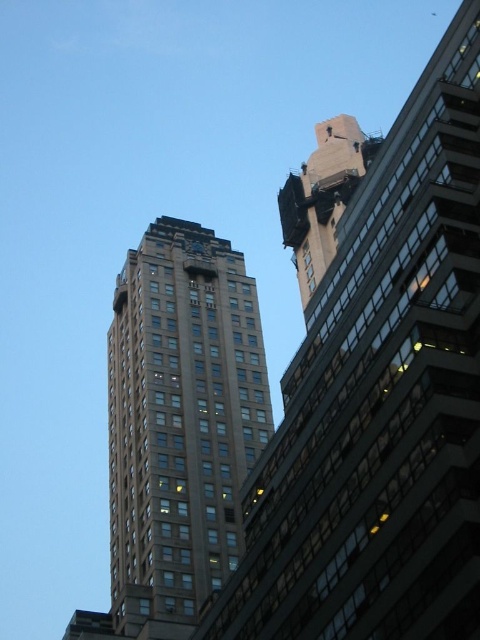
How much distance is there between brown glassy building at upper left and brown stone building at center?

23.51 meters

Is point (251, 572) farther from camera compared to point (235, 476)?

No.

Does point (444, 296) lie in front of point (117, 541)?

Yes, it is in front of point (117, 541).

At what (x,y) coordinates should I click in order to perform the action: click on brown glassy building at upper left. Please return your answer as a coordinate pair (x, y). The width and height of the screenshot is (480, 640). Looking at the image, I should click on (382, 401).

Who is more distant from viewer, (380, 502) or (304, 305)?

Positioned behind is point (304, 305).

Is point (274, 548) behind point (323, 147)?

That is False.

Is point (321, 403) in front of point (316, 170)?

That is True.

At what (x,y) coordinates should I click in order to perform the action: click on brown glassy building at upper left. Please return your answer as a coordinate pair (x, y). This screenshot has width=480, height=640. Looking at the image, I should click on (382, 401).

Can you confirm if brown stone building at center is smaller than metallic clock at upper center?

No.

Which is below, brown stone building at center or metallic clock at upper center?

brown stone building at center is below.

I want to click on brown stone building at center, so click(180, 420).